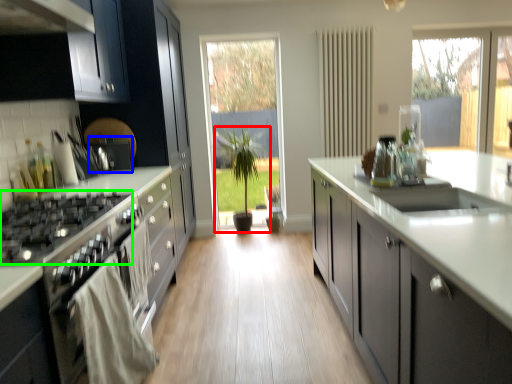
Question: Considering the real-world distances, which object is farthest from houseplant (highlighted by a red box)? appliance (highlighted by a blue box) or gas stove (highlighted by a green box)?

Choices:
 (A) appliance
 (B) gas stove

Answer: (B)